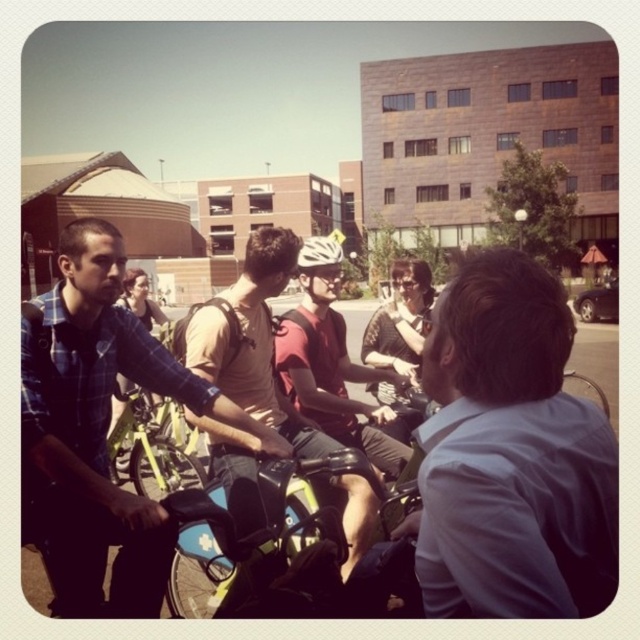
You are a photographer trying to capture a candid shot of the light blue shirt at center and the matte red helmet at center. Since you want to ensure both subjects are in focus, you need to know which one is closer to the camera. Based on the scene description, which subject is nearer to the camera?

The light blue shirt at center is thinner than matte red helmet at center, so the light blue shirt at center is closer to the camera.

You are a photographer trying to capture a group photo of the light blue shirt at center and the matte beige shirt at center. Which person should you focus on to ensure the entire body fits in the frame if your camera has a fixed width setting?

You should focus on the light blue shirt at center because its width is greater than the matte beige shirt at center, ensuring the entire body fits within the frame.

Please describe the position of the plaid shirt at left relative to the beige tshirt at right based on the coordinate system where the bottom left corner is the origin point. The plaid shirt at left has coordinates point (97, 433) and the beige tshirt at right has coordinates point 0.323, 0.847.

The plaid shirt at left is located at coordinates point (97, 433), which is to the right and above the beige tshirt at right at point 0.323, 0.847.